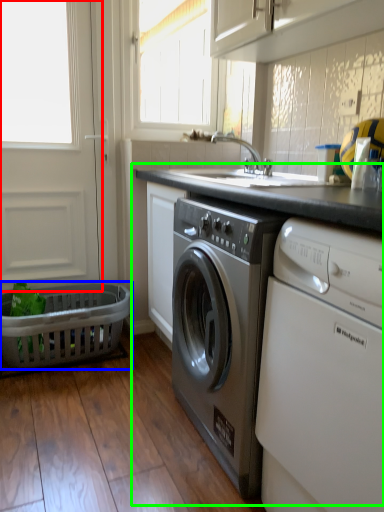
Question: Which is farther away from screen door (highlighted by a red box)? basket (highlighted by a blue box) or counter (highlighted by a green box)?

Choices:
 (A) basket
 (B) counter

Answer: (B)